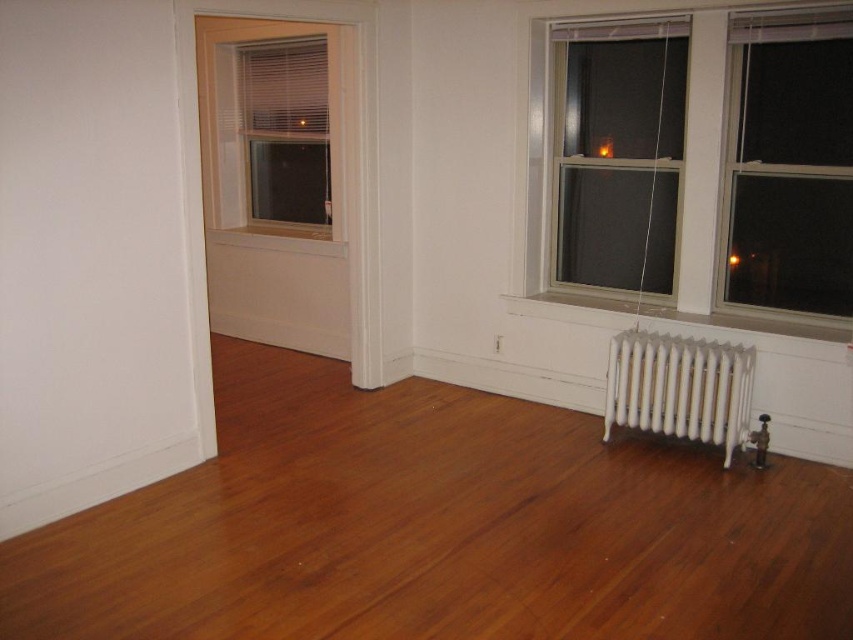
Is point (322, 492) in front of point (737, 444)?

Yes, it is.

Does shiny brown hardwood floor at center lie behind white metallic radiator at lower right?

No, shiny brown hardwood floor at center is in front of white metallic radiator at lower right.

Consider the image. Who is more distant from viewer, (538, 413) or (625, 339)?

The point (538, 413) is more distant.

What are the coordinates of `shiny brown hardwood floor at center` in the screenshot? It's located at (437, 528).

Is transparent glass window at right closer to camera compared to transparent glass window at upper right?

Yes.

Looking at this image, is transparent glass window at right shorter than transparent glass window at upper right?

Yes, transparent glass window at right is shorter than transparent glass window at upper right.

I want to click on transparent glass window at right, so click(788, 163).

Consider the image. Which is more to the left, transparent glass window at upper right or white wood window at upper left?

white wood window at upper left is more to the left.

Does point (648, 65) come behind point (321, 125)?

That is False.

Is point (654, 220) behind point (267, 76)?

No, (654, 220) is in front of (267, 76).

Find the location of a particular element. transparent glass window at upper right is located at coordinates (618, 154).